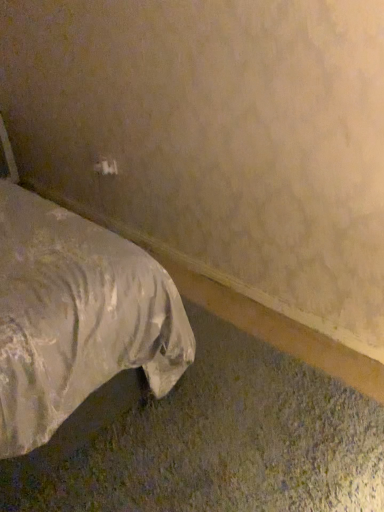
Question: Is white plastic electric outlet at upper center to the left or to the right of white satin bed at lower left in the image?

Choices:
 (A) right
 (B) left

Answer: (A)

Question: In terms of width, does white plastic electric outlet at upper center look wider or thinner when compared to white satin bed at lower left?

Choices:
 (A) wide
 (B) thin

Answer: (B)

Question: Is white plastic electric outlet at upper center bigger or smaller than white satin bed at lower left?

Choices:
 (A) small
 (B) big

Answer: (A)

Question: From their relative heights in the image, would you say white satin bed at lower left is taller or shorter than white plastic electric outlet at upper center?

Choices:
 (A) tall
 (B) short

Answer: (A)

Question: Considering the positions of point (52, 415) and point (109, 173), is point (52, 415) closer or farther from the camera than point (109, 173)?

Choices:
 (A) closer
 (B) farther

Answer: (A)

Question: From the image's perspective, is white satin bed at lower left above or below white plastic electric outlet at upper center?

Choices:
 (A) below
 (B) above

Answer: (A)

Question: Looking at the image, does white satin bed at lower left seem bigger or smaller compared to white plastic electric outlet at upper center?

Choices:
 (A) big
 (B) small

Answer: (A)